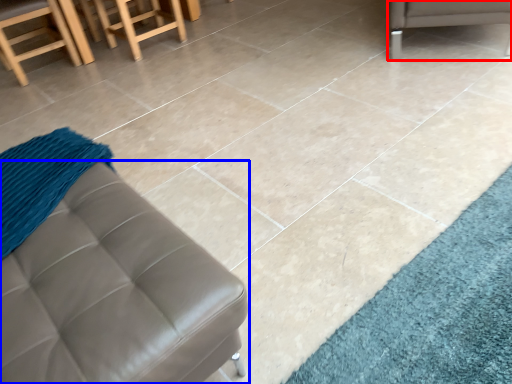
Question: Which object is further to the camera taking this photo, furniture (highlighted by a red box) or furniture (highlighted by a blue box)?

Choices:
 (A) furniture
 (B) furniture

Answer: (A)